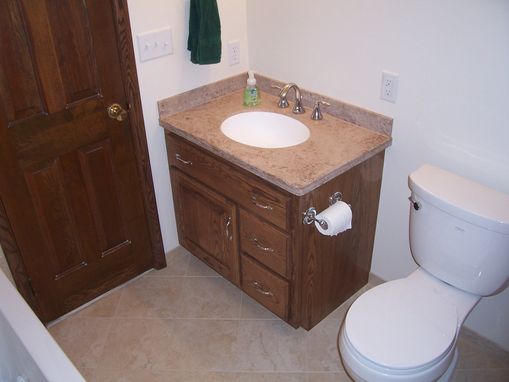
Locate an element on the screen. This screenshot has height=382, width=509. sink counter is located at coordinates (282, 165).